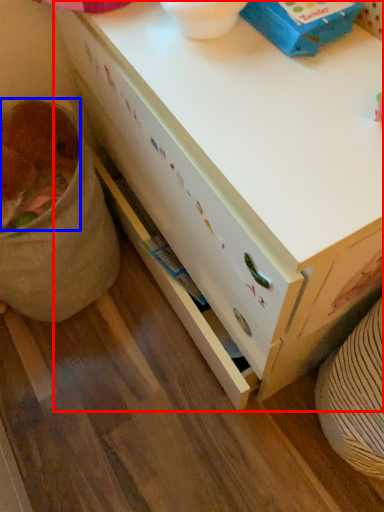
Question: Which point is further to the camera, desk (highlighted by a red box) or animal (highlighted by a blue box)?

Choices:
 (A) desk
 (B) animal

Answer: (B)